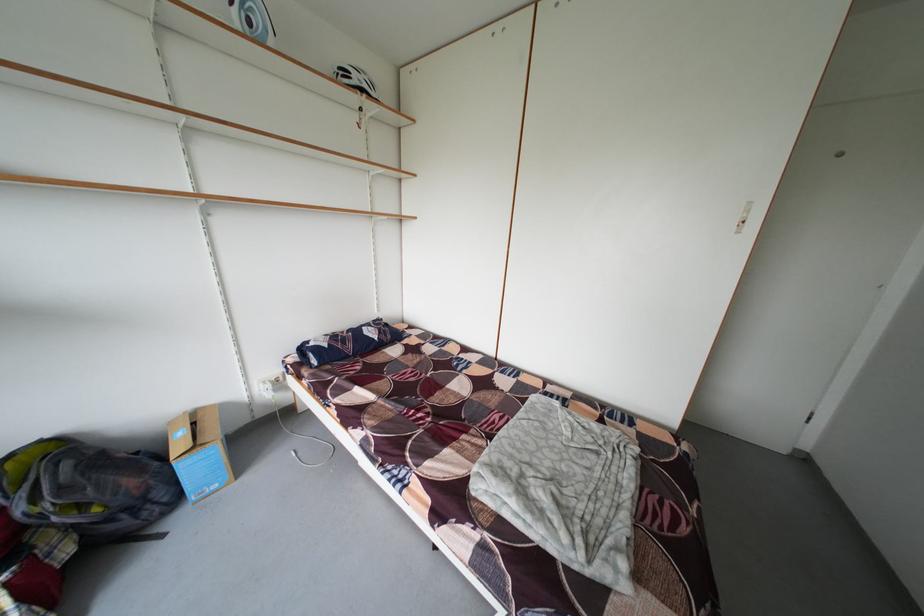
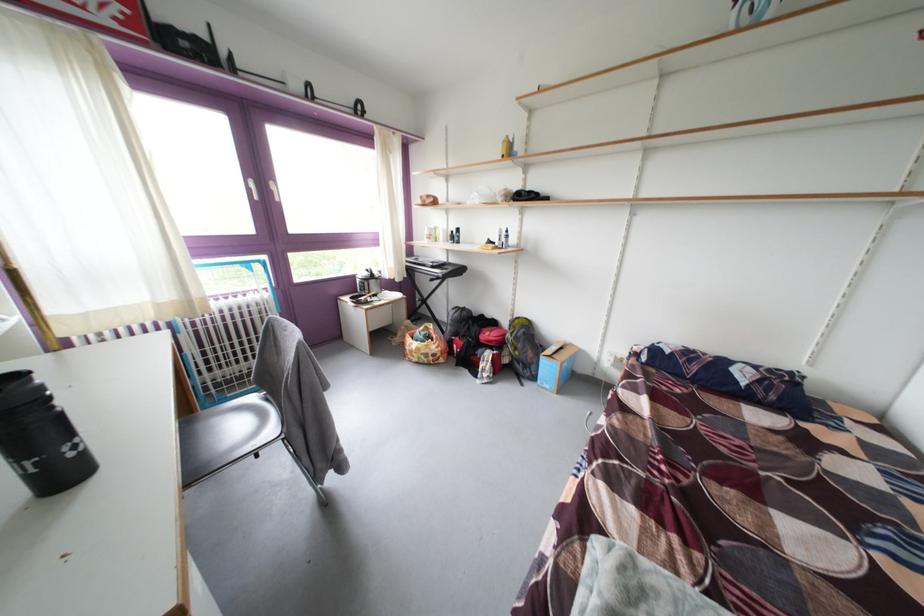
Based on the continuous images, in which direction is the camera rotating?

The rotation direction of the camera is left-down.